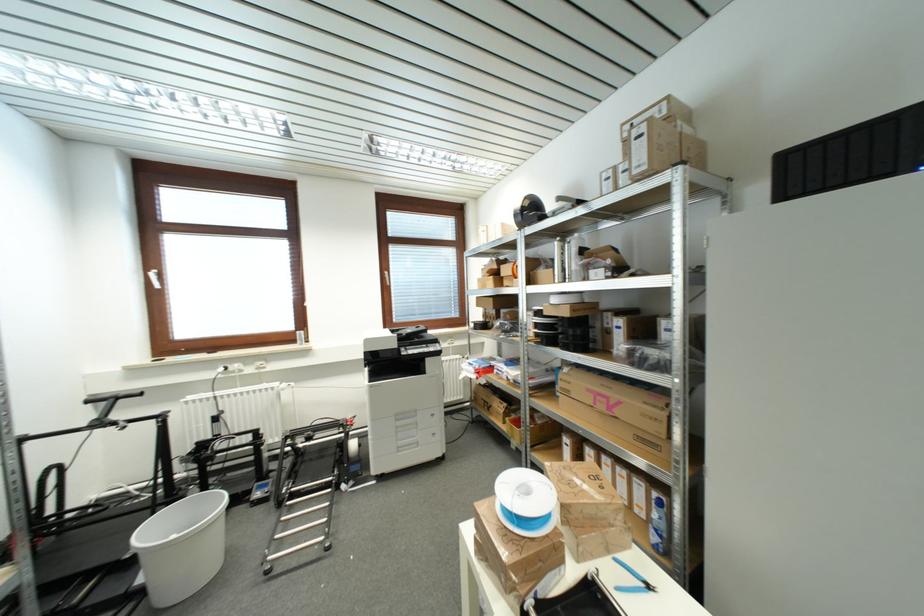
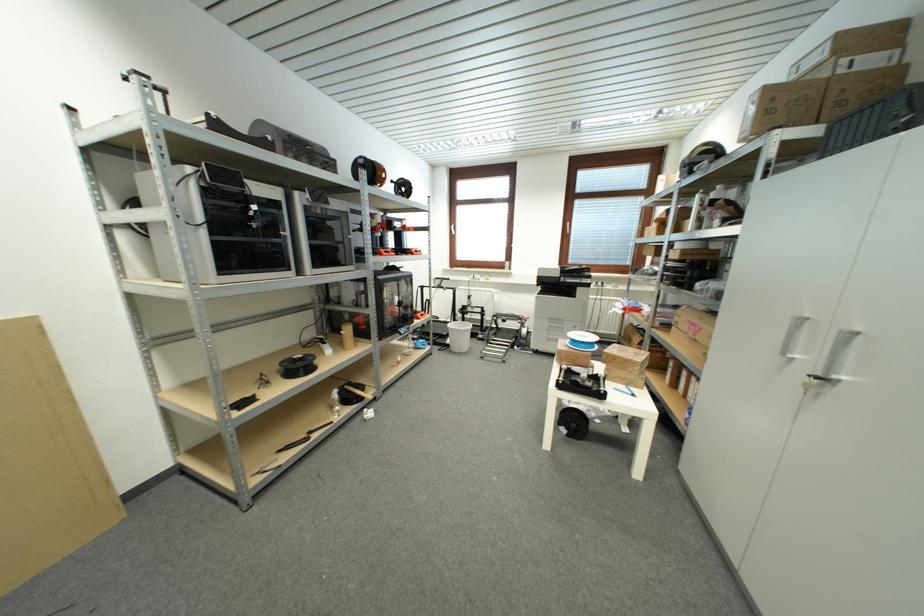
Where in the second image is the point corresponding to [648,131] from the first image?

(761, 99)